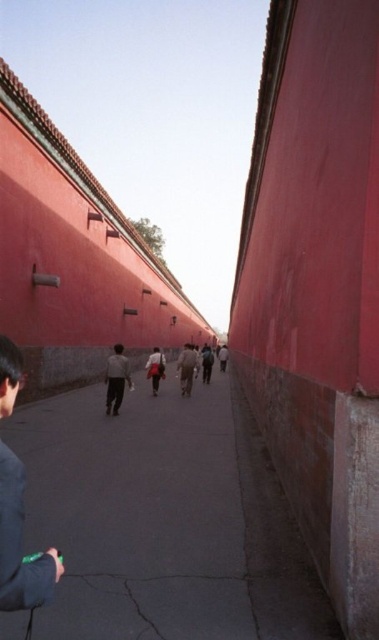
You are standing at the start of the pathway and want to pass between the two jackets, light gray fabric jacket at center and dark brown leather jacket at center, without touching either. Is there enough space between them to walk through?

The light gray fabric jacket at center might be wider than dark brown leather jacket at center, so there may not be enough space to walk between them safely. It is recommended to wait or find an alternative path to avoid collision.

Based on the photo, you are a photographer standing at the end of the pathway. You notice two jackets worn by people walking away from you. The jackets are the light gray fabric jacket at center and the dark brown leather jacket at center. Which jacket appears shorter in the photo?

The light gray fabric jacket at center appears shorter compared to the dark brown leather jacket at center in the photo.